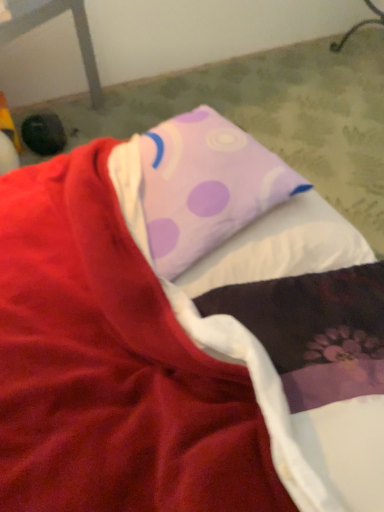
This screenshot has height=512, width=384. What do you see at coordinates (205, 186) in the screenshot? I see `purple dotted pillow at center` at bounding box center [205, 186].

You are a GUI agent. You are given a task and a screenshot of the screen. Output one action in this format:
    pyautogui.click(x=<x>, y=<y>)
    Task: Click on the purple dotted pillow at center
    This screenshot has height=512, width=384.
    Given the screenshot: What is the action you would take?
    pyautogui.click(x=205, y=186)

This screenshot has width=384, height=512. I want to click on purple dotted pillow at center, so click(205, 186).